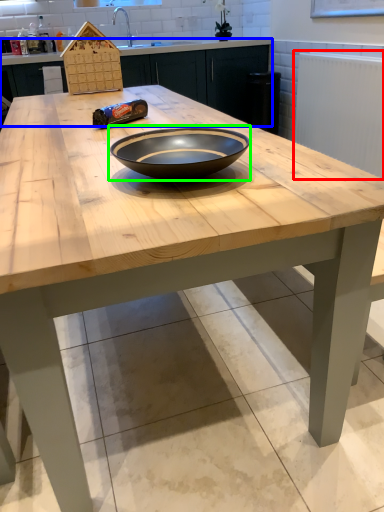
Question: Estimate the real-world distances between objects in this image. Which object is farther from radiator (highlighted by a red box), cabinetry (highlighted by a blue box) or bowl (highlighted by a green box)?

Choices:
 (A) cabinetry
 (B) bowl

Answer: (B)